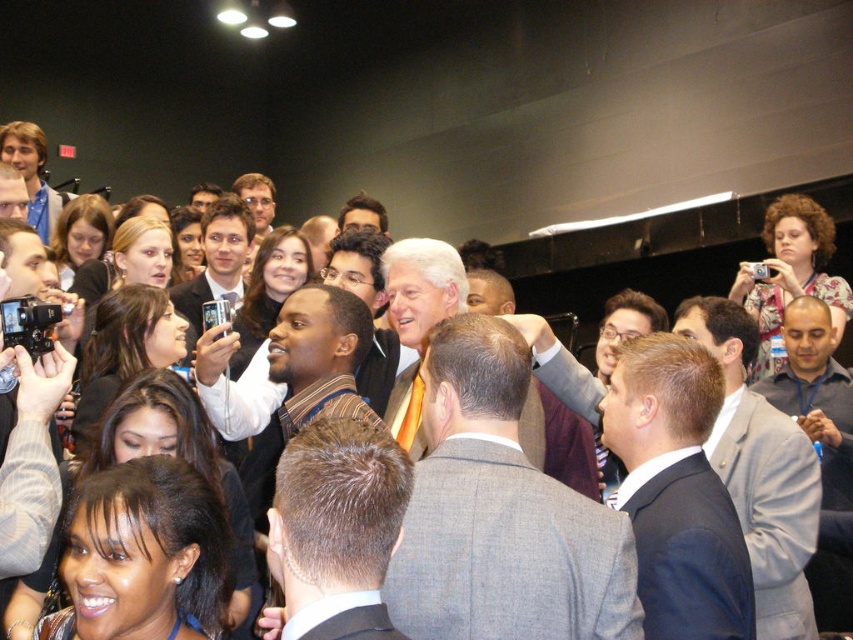
Question: Does light brown suit at center appear on the right side of matte black camera at lower left?

Choices:
 (A) no
 (B) yes

Answer: (B)

Question: Does dark gray suit at center have a larger size compared to matte black suit at center?

Choices:
 (A) no
 (B) yes

Answer: (A)

Question: Which of the following is the closest to the observer?

Choices:
 (A) dark gray suit at center
 (B) light brown suit at center

Answer: (A)

Question: Can you confirm if dark brown hair at center is positioned to the left of matte black camera at lower left?

Choices:
 (A) no
 (B) yes

Answer: (A)

Question: Which object appears closest to the camera in this image?

Choices:
 (A) dark gray suit at center
 (B) orange tie at center
 (C) matte black suit at center
 (D) light brown suit at center

Answer: (B)

Question: Estimate the real-world distances between objects in this image. Which object is farther from the matte black camera at lower left?

Choices:
 (A) light brown suit at center
 (B) orange tie at center

Answer: (A)